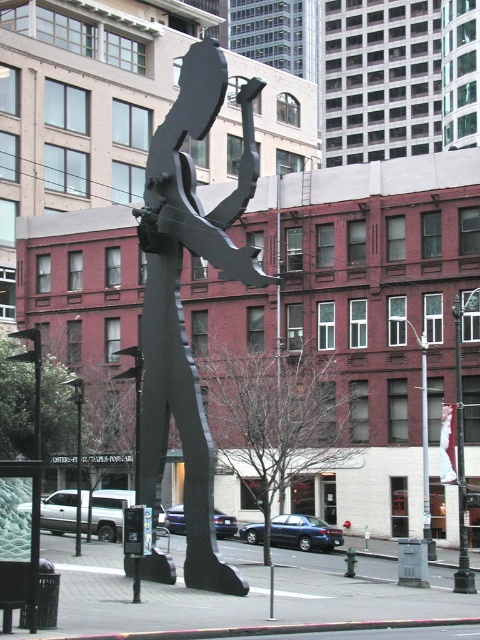
Can you confirm if black metal sculpture at center is thinner than metallic pole at center?

Yes.

Who is lower down, black metal sculpture at center or metallic pole at center?

Positioned lower is metallic pole at center.

Does point (186, 432) lie in front of point (425, 394)?

Yes, it is in front of point (425, 394).

Find the location of a particular element. The height and width of the screenshot is (640, 480). black metal sculpture at center is located at coordinates (180, 300).